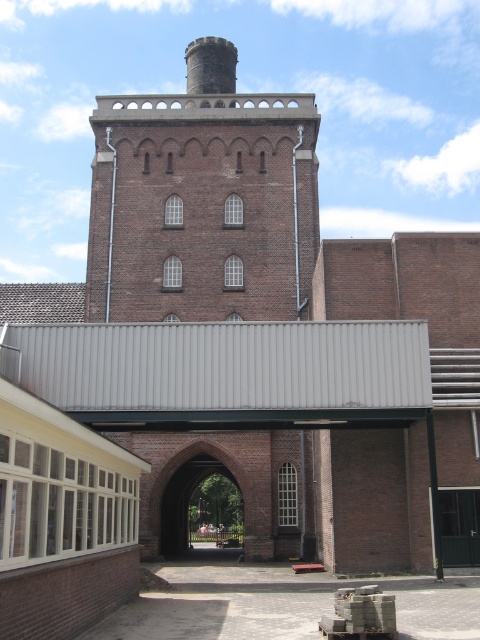
Is point (232, 179) closer to camera compared to point (223, 65)?

Yes, it is.

Where is `brown brick tower at upper center`? Image resolution: width=480 pixels, height=640 pixels. brown brick tower at upper center is located at coordinates (203, 205).